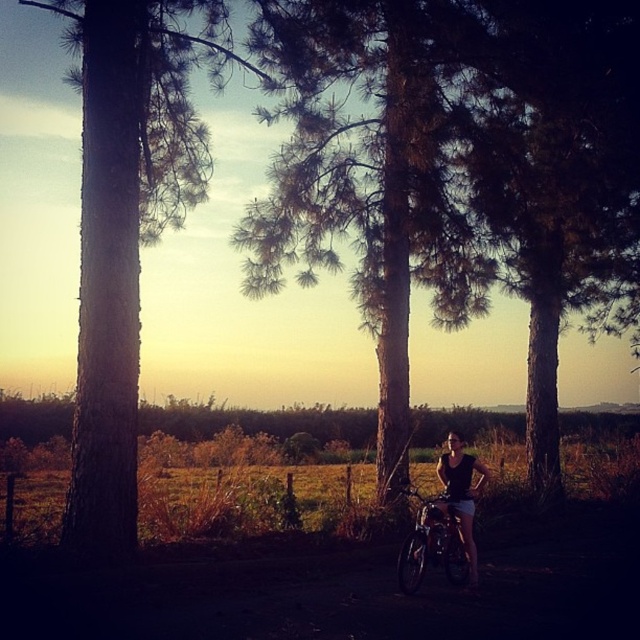
You are planning to ride the shiny metallic bicycle at center through the open field. The green textured tree at center is in your path. Can you ride your bicycle around the tree without going off the field?

The distance between the green textured tree at center and the shiny metallic bicycle at center is 23.30 feet. Since the field is open and the distance is sufficient, you can easily ride around the tree while staying on the field.